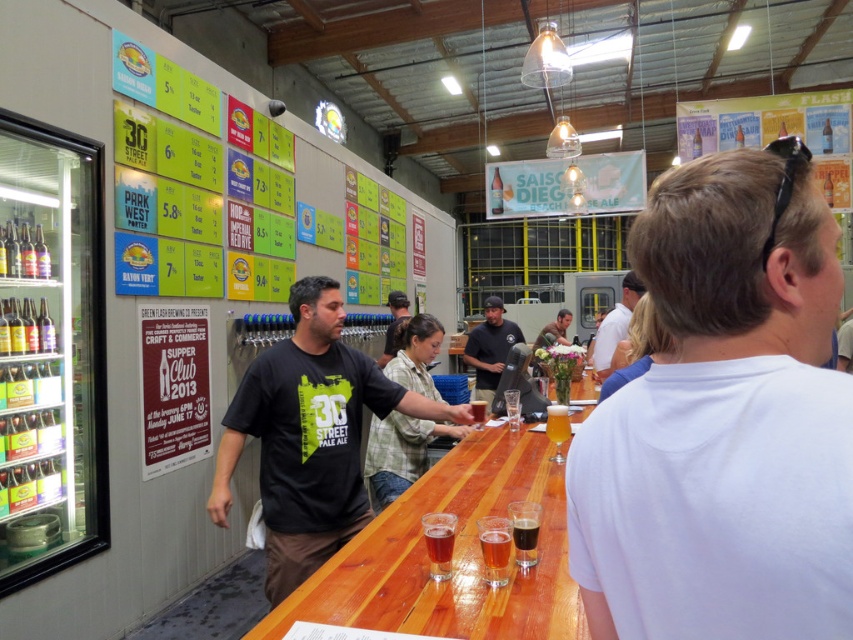
Question: Considering the relative positions of white cotton shirt at upper right and white cotton shirt at center in the image provided, where is white cotton shirt at upper right located with respect to white cotton shirt at center?

Choices:
 (A) right
 (B) left

Answer: (B)

Question: Which of the following is the closest to the observer?

Choices:
 (A) dark gray t-shirt at center
 (B) white cotton shirt at center

Answer: (B)

Question: Which point is closer to the camera taking this photo?

Choices:
 (A) (403, 316)
 (B) (500, 339)
 (C) (653, 312)
 (D) (618, 324)

Answer: (C)

Question: Estimate the real-world distances between objects in this image. Which object is farther from the white cotton shirt at center?

Choices:
 (A) green plaid shirt at center
 (B) dark gray t-shirt at center

Answer: (B)

Question: Is matte black shirt at center above brown glass at bar?

Choices:
 (A) no
 (B) yes

Answer: (B)

Question: Can you confirm if white cotton shirt at upper right is bigger than matte black shirt at center?

Choices:
 (A) yes
 (B) no

Answer: (B)